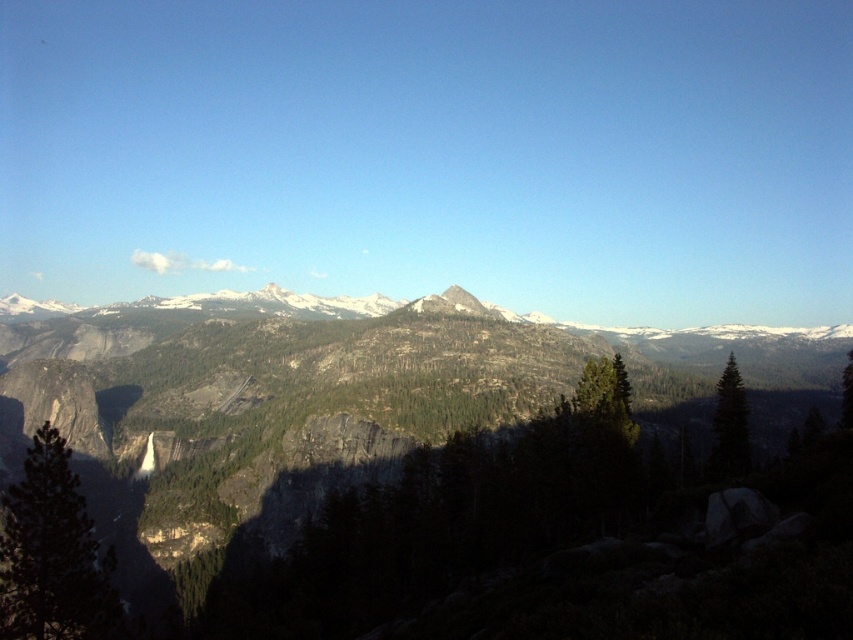
You are a hiker planning to take a photo of the rocky mountain range at center and the green matte tree at center from a specific viewpoint. Based on their positions, which object will appear closer to you in the photo?

The rocky mountain range at center appears closer because it is positioned in front of the green matte tree at center in the scene.

You are a hiker planning to take a photo of the rocky mountain range at center and the green matte tree at right. Which object will appear closer to the top of your camera frame?

The rocky mountain range at center is located above the green matte tree at right, so it will appear closer to the top of your camera frame.

You are standing at the center of the image and want to locate the green matte tree at lower left. Based on the coordinates provided, in which direction should you look to find it?

The green matte tree at lower left is located at point coordinates, so you should look to the lower left direction to find it.